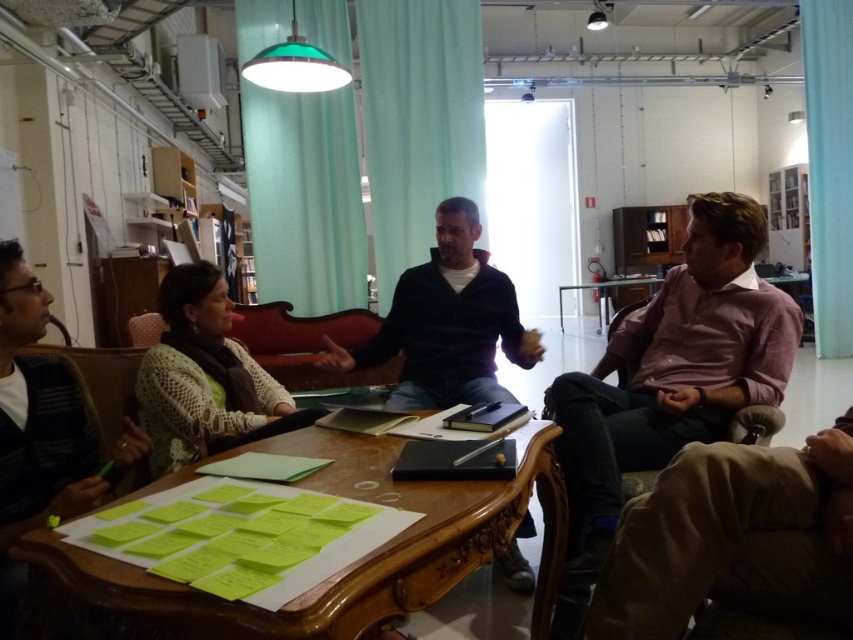
Question: Is pink fabric shirt at right in front of white knitted sweater at left?

Choices:
 (A) yes
 (B) no

Answer: (A)

Question: Which of the following is the farthest from the observer?

Choices:
 (A) pink fabric shirt at right
 (B) green fabric curtain at upper center
 (C) wooden table at center

Answer: (B)

Question: Which object is positioned farthest from the pink fabric shirt at right?

Choices:
 (A) white knitted sweater at left
 (B) teal fabric curtain at center
 (C) dark blue sweater at center
 (D) teal fabric curtain at upper right

Answer: (D)

Question: Which point is farther to the camera?

Choices:
 (A) dark blue sweater at center
 (B) green fabric curtain at upper center
 (C) teal fabric curtain at center

Answer: (C)

Question: Does teal fabric curtain at center lie behind dark blue sweater at center?

Choices:
 (A) yes
 (B) no

Answer: (A)

Question: From the image, what is the correct spatial relationship of green fabric curtain at upper center in relation to dark blue sweater at center?

Choices:
 (A) below
 (B) above

Answer: (B)